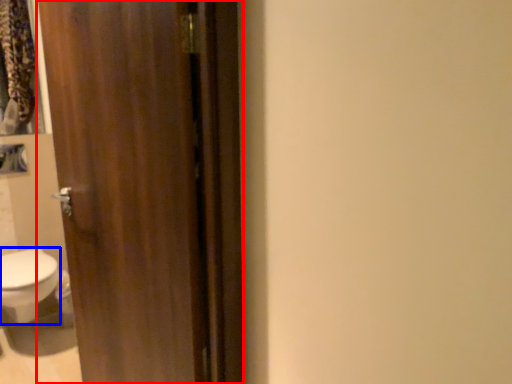
Question: Which object is closer to the camera taking this photo, door (highlighted by a red box) or bidet (highlighted by a blue box)?

Choices:
 (A) door
 (B) bidet

Answer: (A)